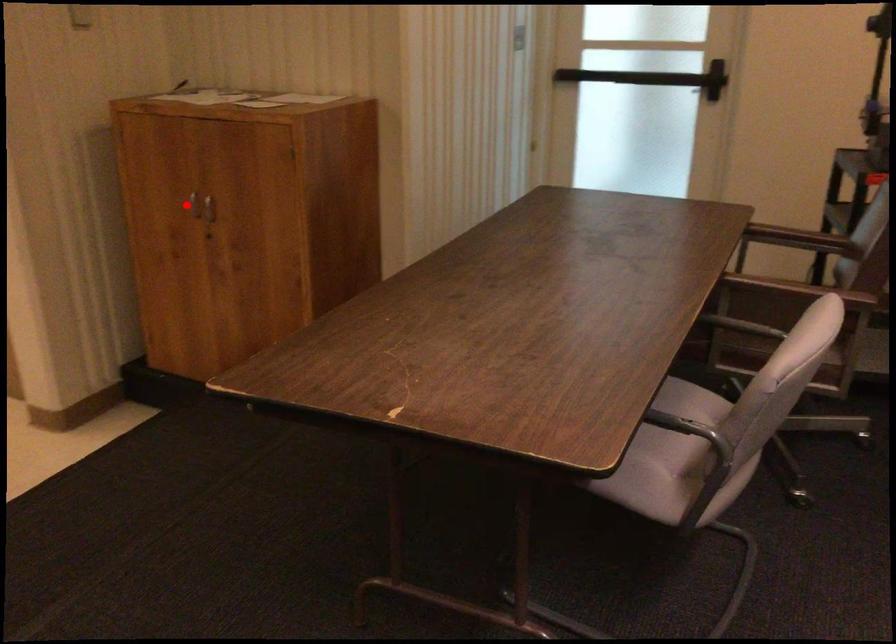
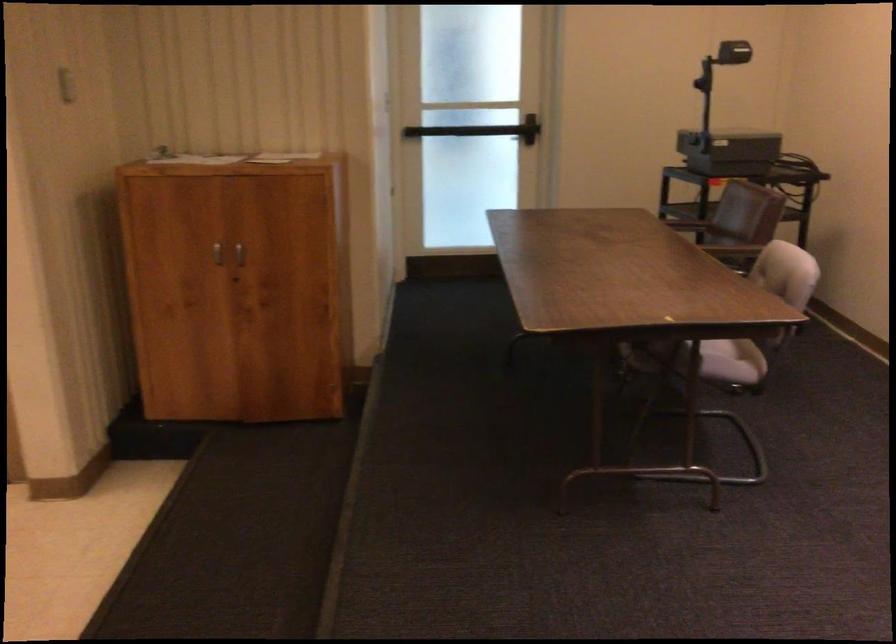
Locate, in the second image, the point that corresponds to the highlighted location in the first image.

(217, 252)